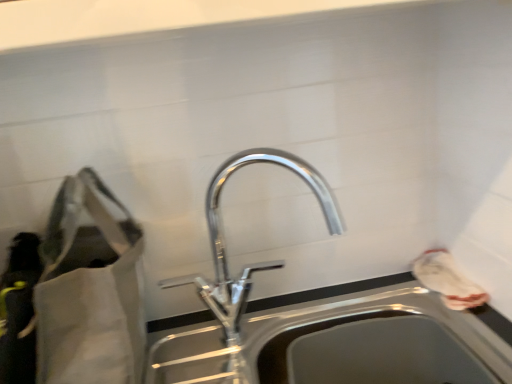
Question: Do you think white fabric bag at right, the 1th bag positioned from the right, is within polished chrome tap at center, or outside of it?

Choices:
 (A) inside
 (B) outside

Answer: (B)

Question: From the image's perspective, is white fabric bag at right, the 1th bag positioned from the right, positioned above or below polished chrome tap at center?

Choices:
 (A) above
 (B) below

Answer: (B)

Question: Which of these objects is positioned farthest from the white fabric bag at right, arranged as the 2th bag when viewed from the left?

Choices:
 (A) matte gray bag at left, positioned as the first bag in left-to-right order
 (B) polished chrome tap at center
 (C) stainless steel sink at center

Answer: (A)

Question: Based on their relative distances, which object is farther from the matte gray bag at left, positioned as the first bag in left-to-right order?

Choices:
 (A) polished chrome tap at center
 (B) stainless steel sink at center
 (C) white fabric bag at right, arranged as the 2th bag when viewed from the left

Answer: (C)